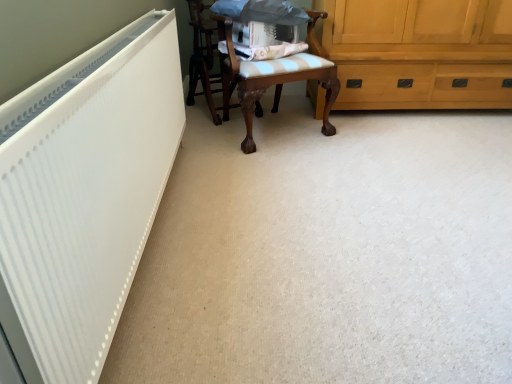
Question: In the image, is wooden chair with cushion at center, which is the second chair from right to left, on the left side or the right side of wooden chair with striped cushion at center, which is the 2th chair in left-to-right order?

Choices:
 (A) right
 (B) left

Answer: (B)

Question: Considering their positions, is wooden chair with cushion at center, the first chair viewed from the left, located in front of or behind wooden chair with striped cushion at center, the 1th chair positioned from the right?

Choices:
 (A) front
 (B) behind

Answer: (B)

Question: Based on their relative distances, which object is nearer to the white matte radiator at left?

Choices:
 (A) wooden chair with cushion at center, which is the second chair from right to left
 (B) wooden chair with striped cushion at center, which is the 2th chair in left-to-right order
 (C) light brown wood cabinet at right

Answer: (B)

Question: Which of these objects is positioned farthest from the white matte radiator at left?

Choices:
 (A) wooden chair with striped cushion at center, which is the 2th chair in left-to-right order
 (B) light brown wood cabinet at right
 (C) wooden chair with cushion at center, the first chair viewed from the left

Answer: (B)